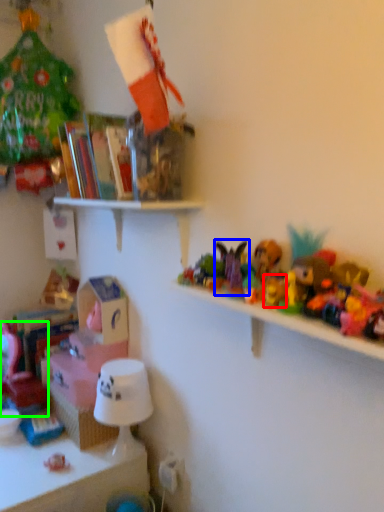
Question: Which object is the farthest from toy (highlighted by a red box)? Choose among these: toy (highlighted by a blue box) or toy (highlighted by a green box).

Choices:
 (A) toy
 (B) toy

Answer: (B)